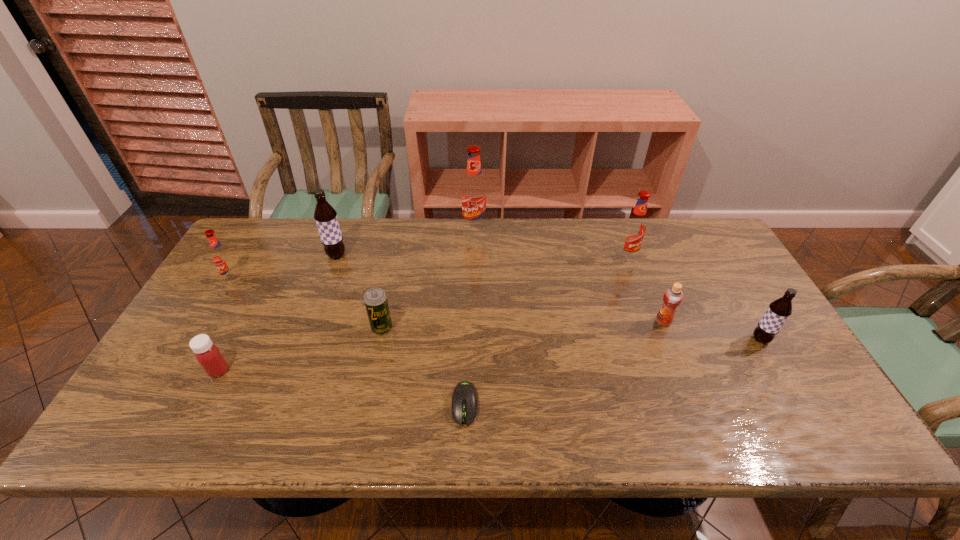
This screenshot has height=540, width=960. Identify the location of vacant space in between the smallest red root beer and the computer mouse. (348, 342).

Locate an element on the screen. The height and width of the screenshot is (540, 960). free spot between the orange juice and the eighth farthest object is located at coordinates (441, 346).

What are the coordinates of `unoccupied position between the smallest red root beer and the second root beer from right to left` in the screenshot? It's located at tap(429, 268).

Locate an element on the screen. This screenshot has height=540, width=960. vacant area that lies between the eighth object from right to left and the second root beer from right to left is located at coordinates (422, 314).

Point out which object is positioned as the fifth nearest to the rightmost red root beer. Please provide its 2D coordinates. Your answer should be formatted as a tuple, i.e. [(x, y)], where the tuple contains the x and y coordinates of a point satisfying the conditions above.

[(375, 299)]

Identify which object is located as the fifth nearest to the second root beer from right to left. Please provide its 2D coordinates. Your answer should be formatted as a tuple, i.e. [(x, y)], where the tuple contains the x and y coordinates of a point satisfying the conditions above.

[(375, 299)]

I want to click on root beer that is the second closest to the leftmost root beer, so tap(474, 192).

Where is `root beer that is the fifth closest one to the nearest object`? This screenshot has width=960, height=540. root beer that is the fifth closest one to the nearest object is located at coordinates (221, 257).

Locate an element on the screen. This screenshot has height=540, width=960. red root beer that stands as the closest to the rightmost red root beer is located at coordinates (474, 192).

Choose which red root beer is the nearest neighbor to the nearer brown root beer. Please provide its 2D coordinates. Your answer should be formatted as a tuple, i.e. [(x, y)], where the tuple contains the x and y coordinates of a point satisfying the conditions above.

[(634, 229)]